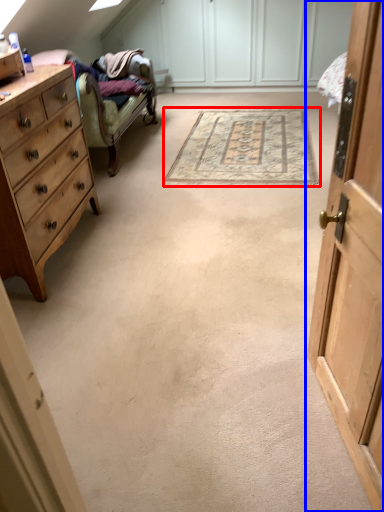
Question: Which object appears closest to the camera in this image, mat (highlighted by a red box) or cabinetry (highlighted by a blue box)?

Choices:
 (A) mat
 (B) cabinetry

Answer: (B)